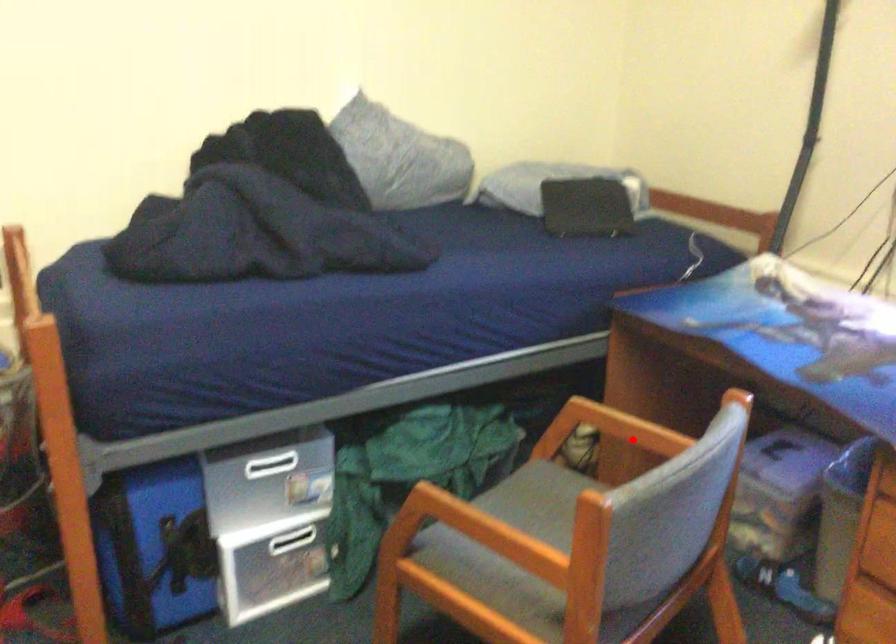
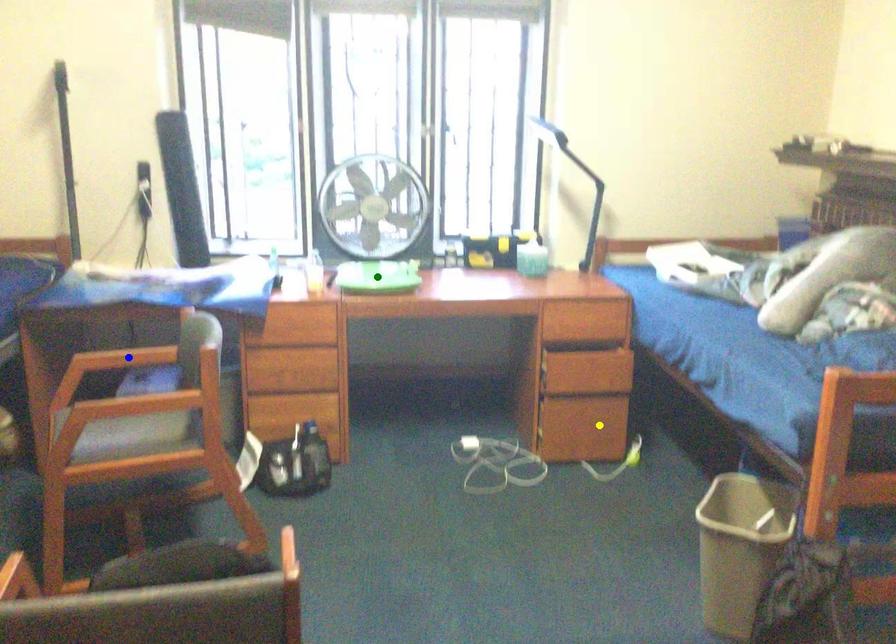
Question: I am providing you with two images of the same scene from different viewpoints. A red point is marked on the first image. You are given multiple points on the second image. Which point in image 2 is actually the same real-world point as the red point in image 1?

Choices:
 (A) yellow point
 (B) blue point
 (C) green point

Answer: (B)